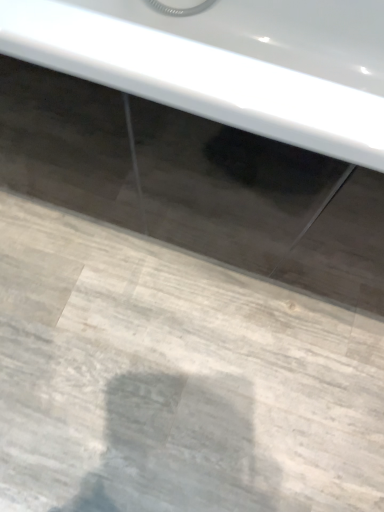
Question: Should I look upward or downward to see white glossy bathtub at upper center?

Choices:
 (A) down
 (B) up

Answer: (B)